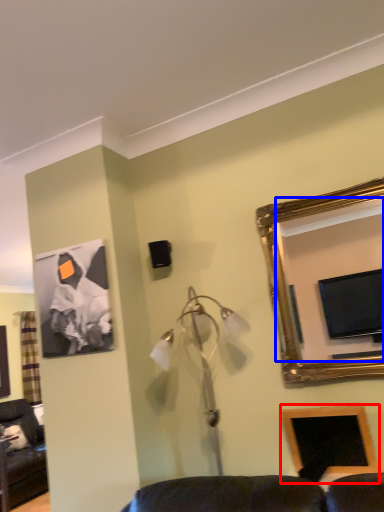
Question: Which point is further to the camera, picture frame (highlighted by a red box) or mirror (highlighted by a blue box)?

Choices:
 (A) picture frame
 (B) mirror

Answer: (A)